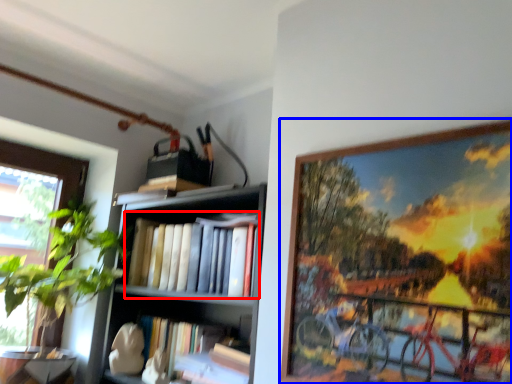
Question: Which object is further to the camera taking this photo, book (highlighted by a red box) or picture frame (highlighted by a blue box)?

Choices:
 (A) book
 (B) picture frame

Answer: (A)